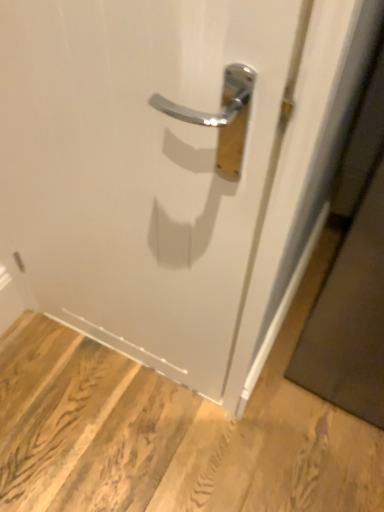
What do you see at coordinates (165, 438) in the screenshot? I see `wooden floor at lower left` at bounding box center [165, 438].

Where is `wooden floor at lower left`? This screenshot has width=384, height=512. wooden floor at lower left is located at coordinates (165, 438).

This screenshot has height=512, width=384. Find the location of `wooden floor at lower left`. wooden floor at lower left is located at coordinates (165, 438).